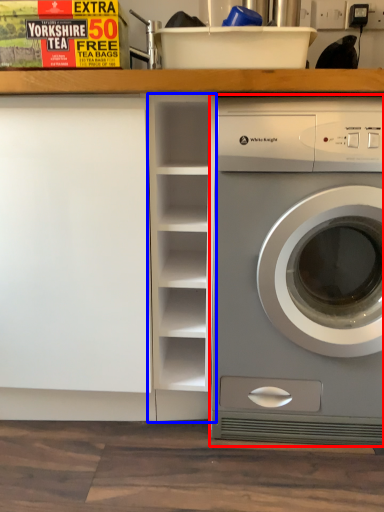
Question: Which point is closer to the camera, washing machine (highlighted by a red box) or bookshelf (highlighted by a blue box)?

Choices:
 (A) washing machine
 (B) bookshelf

Answer: (A)